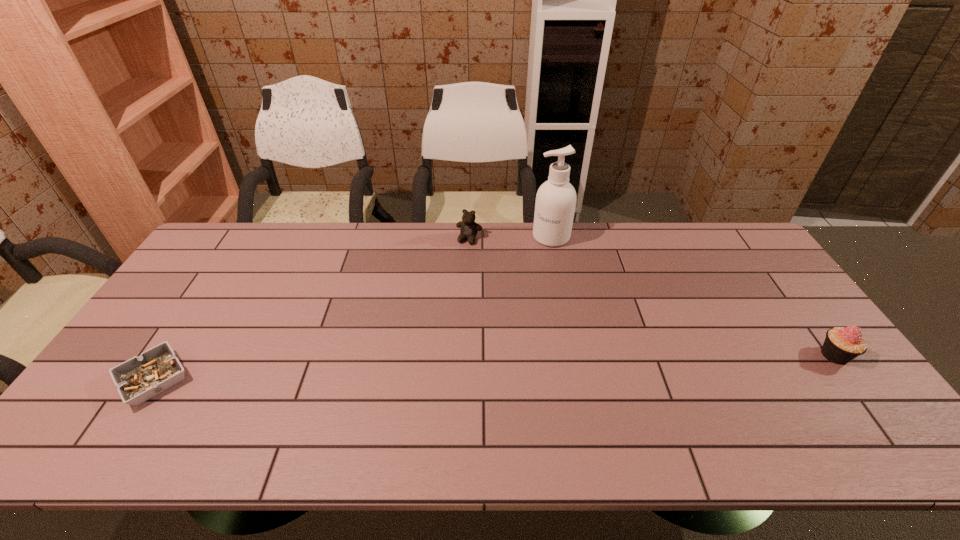
The height and width of the screenshot is (540, 960). In order to click on ashtray in this screenshot , I will do `click(138, 379)`.

Identify the location of the shortest object. This screenshot has width=960, height=540. (138, 379).

Where is `cupcake`? This screenshot has height=540, width=960. cupcake is located at coordinates pos(841,345).

You are a GUI agent. You are given a task and a screenshot of the screen. Output one action in this format:
    pyautogui.click(x=<x>, y=<y>)
    Task: Click on the second object from left to right
    The image size is (960, 540).
    Given the screenshot: What is the action you would take?
    pyautogui.click(x=468, y=227)

Find the location of a particular element. The image size is (960, 540). cleansing agent is located at coordinates (555, 204).

At what (x,y) coordinates should I click in order to perform the action: click on the third object from left to right. Please return your answer as a coordinate pair (x, y). The image size is (960, 540). Looking at the image, I should click on (555, 204).

Find the location of `free space located 0.320m on the right of the leftmost object`. free space located 0.320m on the right of the leftmost object is located at coordinates [x=317, y=380].

The image size is (960, 540). What are the coordinates of `vacant area situated on the back of the cupcake` in the screenshot? It's located at (757, 251).

Locate an element on the screen. The width and height of the screenshot is (960, 540). vacant point located on the face of the second object from left to right is located at coordinates (448, 284).

The image size is (960, 540). I want to click on free region located 0.160m on the face of the second object from left to right, so click(452, 275).